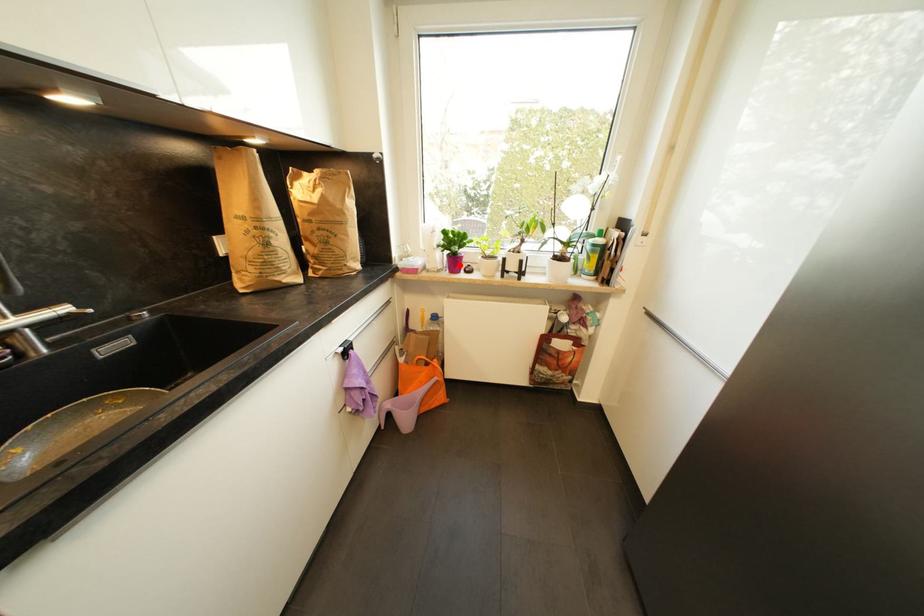
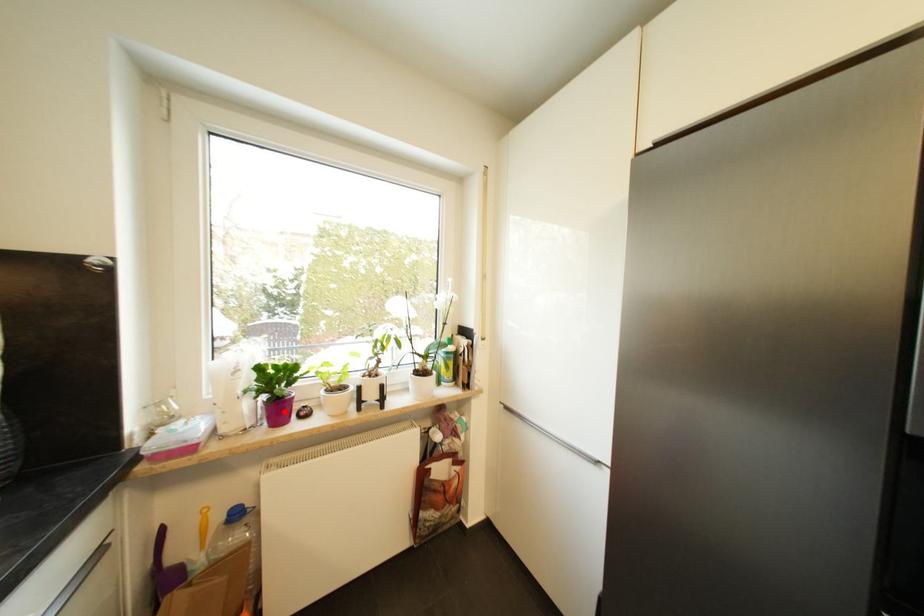
I am providing you with two images of the same scene from different viewpoints. A red point is marked on the first image and another point is marked on the second image. Does the point marked in image1 correspond to the same location as the one in image2?

Yes